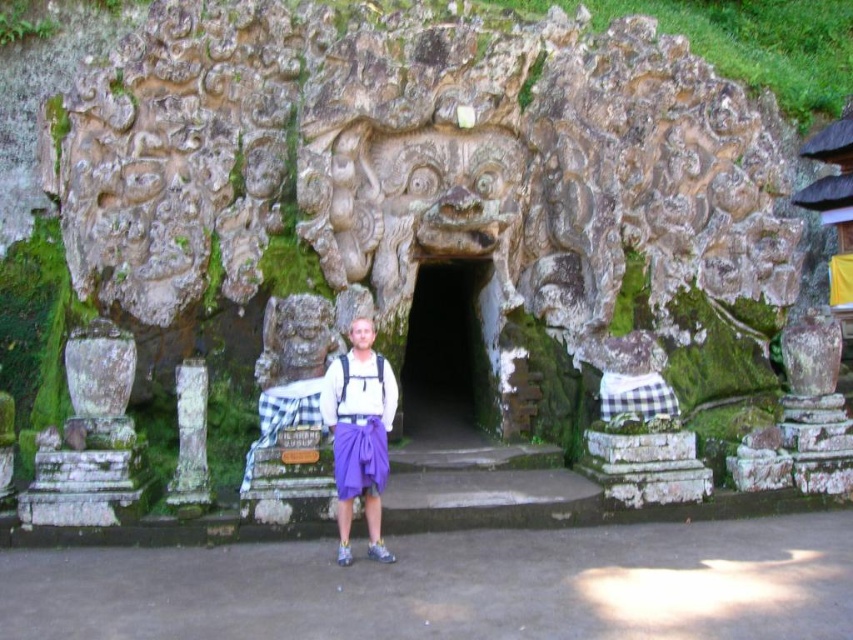
You are a photographer planning to take a photo of the dark stone cave at center and the white stone pillar at center. Given their height difference, which object should you focus on first to ensure both are in frame without cropping?

The dark stone cave at center is much taller than the white stone pillar at center, so you should focus on the dark stone cave at center first to ensure its full height is captured before adjusting the frame to include the white stone pillar at center.

You are a tourist standing in front of the temple entrance. You see a dark stone cave at center and a white stone pillar at center. Which object is located to the right of the other?

The dark stone cave at center is positioned on the right side of white stone pillar at center, so the dark stone cave at center is to the right of the white stone pillar at center.